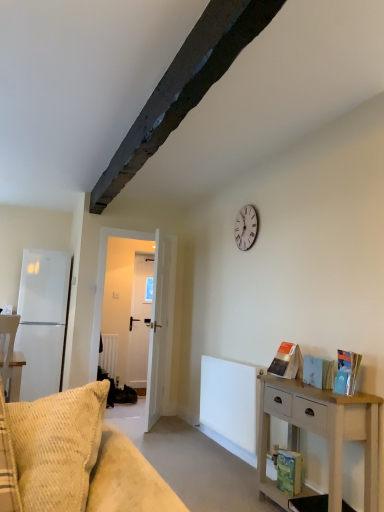
You are a GUI agent. You are given a task and a screenshot of the screen. Output one action in this format:
    pyautogui.click(x=<x>, y=<y>)
    Task: Click on the free space above white wooden door at center (from a real-world perspective)
    Image resolution: width=384 pixels, height=512 pixels.
    Given the screenshot: What is the action you would take?
    pyautogui.click(x=134, y=231)